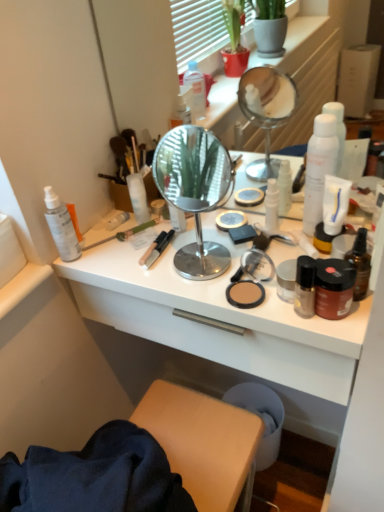
Where is `empty space that is in between polished chrome mirror at center and white matte spray can at left, the seventh toiletry in the right-to-left sequence`? The width and height of the screenshot is (384, 512). empty space that is in between polished chrome mirror at center and white matte spray can at left, the seventh toiletry in the right-to-left sequence is located at coordinates (134, 256).